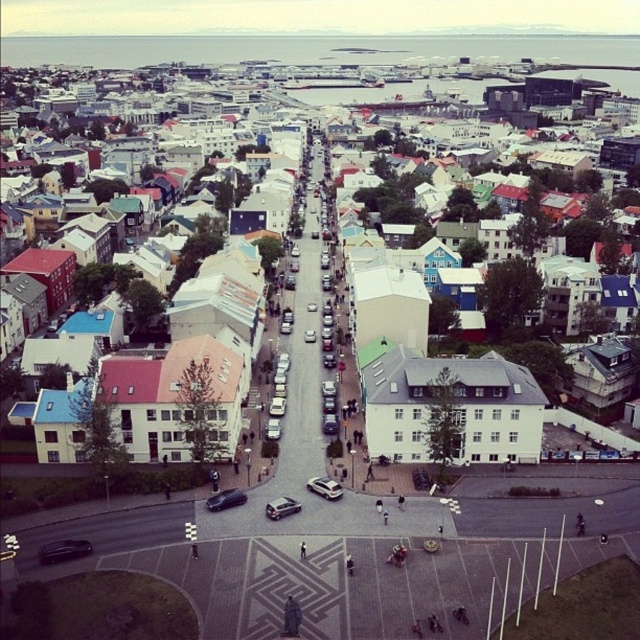
Is point (49, 545) farther from camera compared to point (275, 509)?

No, (49, 545) is closer to viewer.

You are a GUI agent. You are given a task and a screenshot of the screen. Output one action in this format:
    pyautogui.click(x=<x>, y=<y>)
    Task: Click on the shiny black car at center
    The image size is (640, 640).
    Given the screenshot: What is the action you would take?
    pyautogui.click(x=64, y=550)

Does white matte building at center have a lesser height compared to shiny silver car at center?

In fact, white matte building at center may be taller than shiny silver car at center.

From the picture: Does white matte building at center appear on the left side of shiny silver car at center?

In fact, white matte building at center is to the right of shiny silver car at center.

In order to click on white matte building at center in this screenshot , I will do `click(355, 262)`.

Is white matte building at center below silver metallic hatchback at center?

No, white matte building at center is not below silver metallic hatchback at center.

Does white matte building at center have a smaller size compared to silver metallic hatchback at center?

Actually, white matte building at center might be larger than silver metallic hatchback at center.

This screenshot has width=640, height=640. What are the coordinates of `white matte building at center` in the screenshot? It's located at (355, 262).